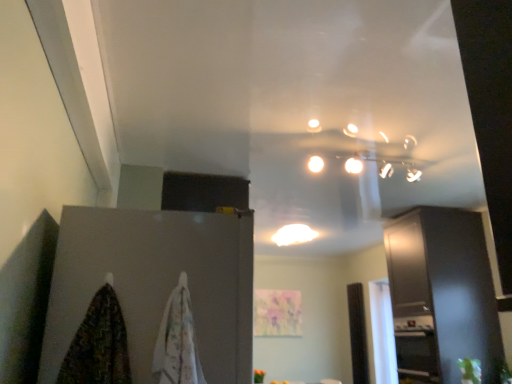
Question: Are multicolored fabric at lower left, which is the second blanket in right-to-left order, and white cotton towel at lower left, which appears as the 1th blanket when viewed from the right, beside each other?

Choices:
 (A) no
 (B) yes

Answer: (A)

Question: Is multicolored fabric at lower left, the first blanket positioned from the left, facing towards white cotton towel at lower left, which appears as the 1th blanket when viewed from the right?

Choices:
 (A) yes
 (B) no

Answer: (B)

Question: Does multicolored fabric at lower left, which is the second blanket in right-to-left order, have a greater width compared to white cotton towel at lower left, which appears as the 1th blanket when viewed from the right?

Choices:
 (A) no
 (B) yes

Answer: (B)

Question: Can you confirm if multicolored fabric at lower left, the first blanket positioned from the left, is positioned to the right of white cotton towel at lower left, which appears as the 1th blanket when viewed from the right?

Choices:
 (A) yes
 (B) no

Answer: (B)

Question: From a real-world perspective, is multicolored fabric at lower left, the first blanket positioned from the left, located beneath white cotton towel at lower left, arranged as the second blanket when viewed from the left?

Choices:
 (A) no
 (B) yes

Answer: (B)

Question: In terms of height, does white cotton towel at lower left, arranged as the second blanket when viewed from the left, look taller or shorter compared to matte gray cabinet at left, the second cabinetry positioned from the back?

Choices:
 (A) short
 (B) tall

Answer: (A)

Question: Based on their positions, is white cotton towel at lower left, arranged as the second blanket when viewed from the left, located to the left or right of matte gray cabinet at left, the first cabinetry positioned from the front?

Choices:
 (A) left
 (B) right

Answer: (B)

Question: Choose the correct answer: Is white cotton towel at lower left, arranged as the second blanket when viewed from the left, inside matte gray cabinet at left, the first cabinetry positioned from the front, or outside it?

Choices:
 (A) outside
 (B) inside

Answer: (A)

Question: Is point 188,292 positioned closer to the camera than point 72,238?

Choices:
 (A) farther
 (B) closer

Answer: (A)

Question: Looking at their shapes, would you say white glossy light fixture at center is wider or thinner than white cotton towel at lower left, arranged as the second blanket when viewed from the left?

Choices:
 (A) thin
 (B) wide

Answer: (B)

Question: Relative to white cotton towel at lower left, arranged as the second blanket when viewed from the left, is white glossy light fixture at center in front or behind?

Choices:
 (A) behind
 (B) front

Answer: (A)

Question: Which is correct: white glossy light fixture at center is inside white cotton towel at lower left, which appears as the 1th blanket when viewed from the right, or outside of it?

Choices:
 (A) outside
 (B) inside

Answer: (A)

Question: From the image's perspective, is white glossy light fixture at center above or below white cotton towel at lower left, which appears as the 1th blanket when viewed from the right?

Choices:
 (A) below
 (B) above

Answer: (A)

Question: Is point (280, 233) closer or farther from the camera than point (145, 382)?

Choices:
 (A) closer
 (B) farther

Answer: (B)

Question: From the image's perspective, is white glossy light fixture at center located above or below matte gray cabinet at left, the second cabinetry positioned from the back?

Choices:
 (A) below
 (B) above

Answer: (A)